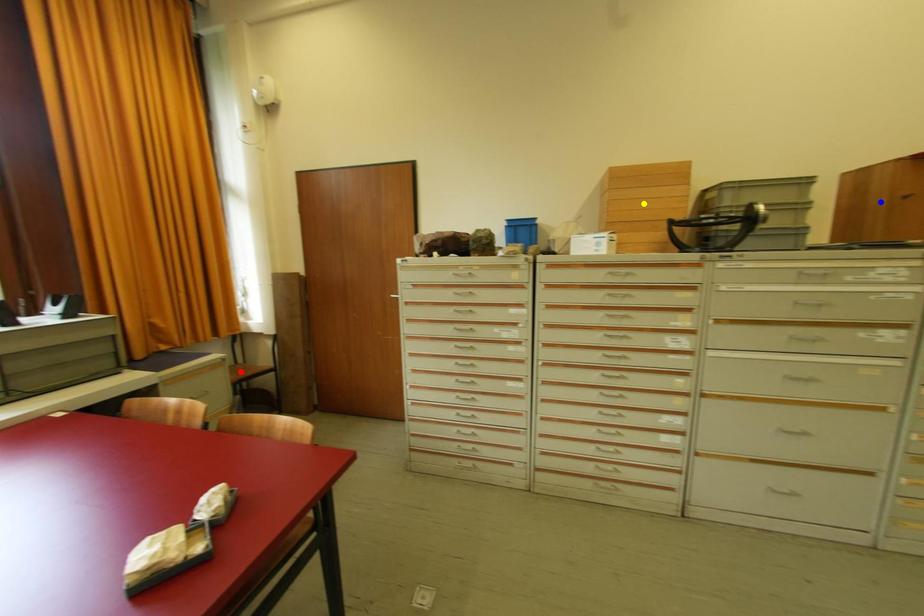
Order these from nearest to farthest:
red point | blue point | yellow point

1. blue point
2. yellow point
3. red point